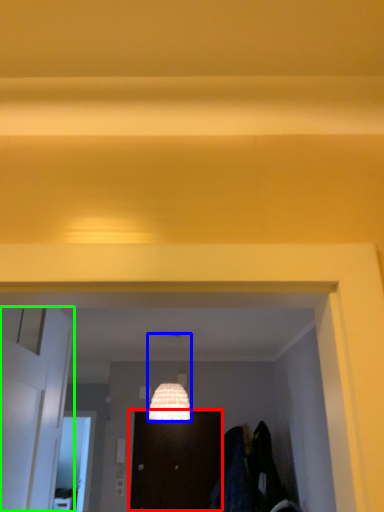
Question: Considering the real-world distances, which object is farthest from door (highlighted by a red box)? lamp (highlighted by a blue box) or door (highlighted by a green box)?

Choices:
 (A) lamp
 (B) door

Answer: (B)